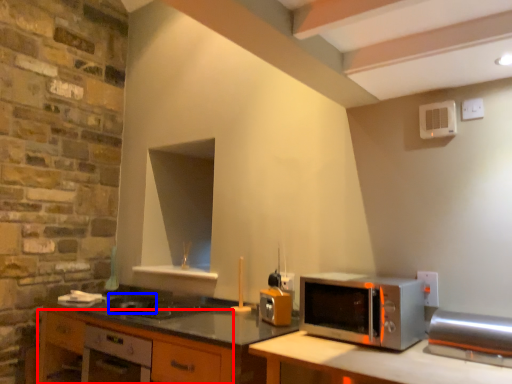
Question: Which object is further to the camera taking this photo, cabinetry (highlighted by a red box) or appliance (highlighted by a blue box)?

Choices:
 (A) cabinetry
 (B) appliance

Answer: (B)